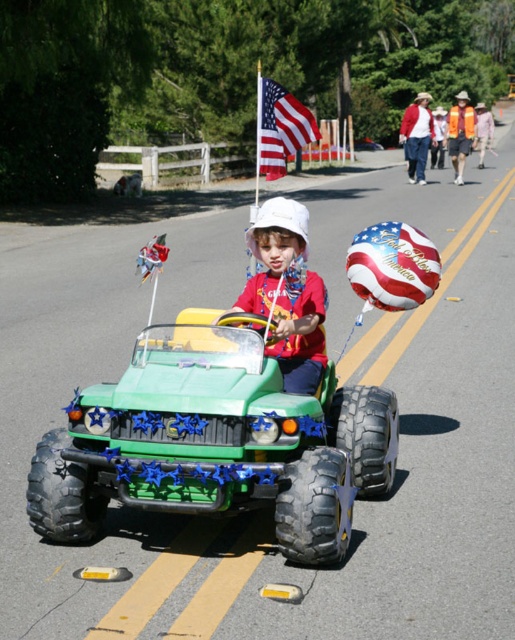
You are a photographer trying to capture a clear photo of the green rubber monster truck at center and the white matte hat at center. Since you want to focus on the smaller object, which one should you zoom in on?

The white matte hat at center is smaller than the green rubber monster truck at center, so you should zoom in on the white matte hat at center to focus on the smaller object.

You are organizing a parade float and need to ensure that all decorations fit within the designated area. The green rubber monster truck at center and the american flag at center are both part of the float. Which decoration takes up more space?

The American flag at center takes up more space than the green rubber monster truck at center because the truck occupies less space than the flag according to the description.

You are standing at the position of the camera observing the scene. There are two points marked in the image, one at point (268,227) and the other at point (423,97). Which point is closer to you?

Point (268,227) is closer to the camera than point (423,97).